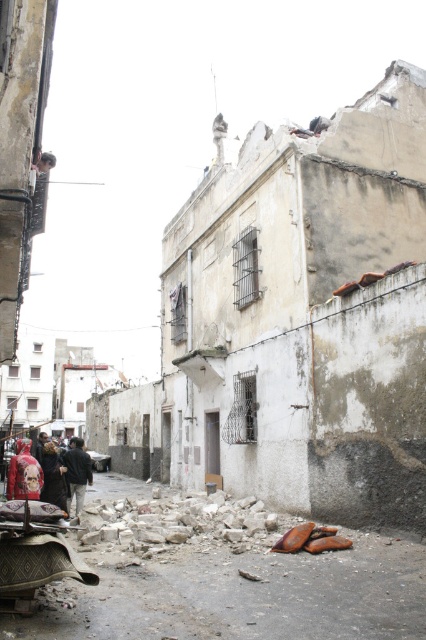
You are a delivery person standing at the entrance of the alleyway. You need to move your rustic wood cart at lower left to the end of the alleyway. The alley is only 6 meters wide. Can you safely maneuver the cart through the alley?

The rustic wood cart at lower left is 6.88 meters from the camera. Since the alley is only 6 meters wide, the cart would require more space than available to maneuver, making it unsafe to proceed without risking damage to the cart or the surrounding structures.

You are standing at the point marked as point (166,573). You need to walk to a point that is exactly 10 meters away from your current position. Is there enough space in the alleyway to move forward without encountering any obstacles?

The distance between the points is 9.53 meters, so you cannot reach exactly 10 meters without encountering obstacles in the alleyway.

You are a delivery person trying to navigate through the narrow alleyway. You see the rusty metal shoes at lower center and the dark gray jacket at lower left. Which object is closer to the ground?

The rusty metal shoes at lower center is below dark gray jacket at lower left, so the rusty metal shoes at lower center is closer to the ground.